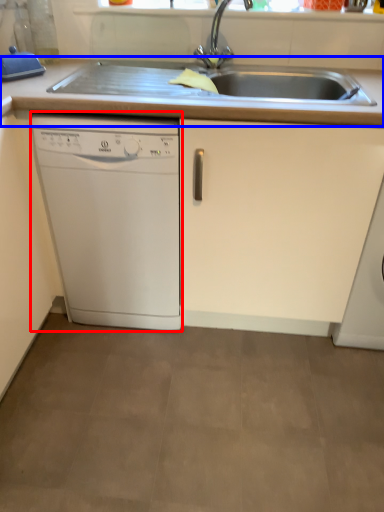
Question: Which object appears farthest to the camera in this image, home appliance (highlighted by a red box) or countertop (highlighted by a blue box)?

Choices:
 (A) home appliance
 (B) countertop

Answer: (A)